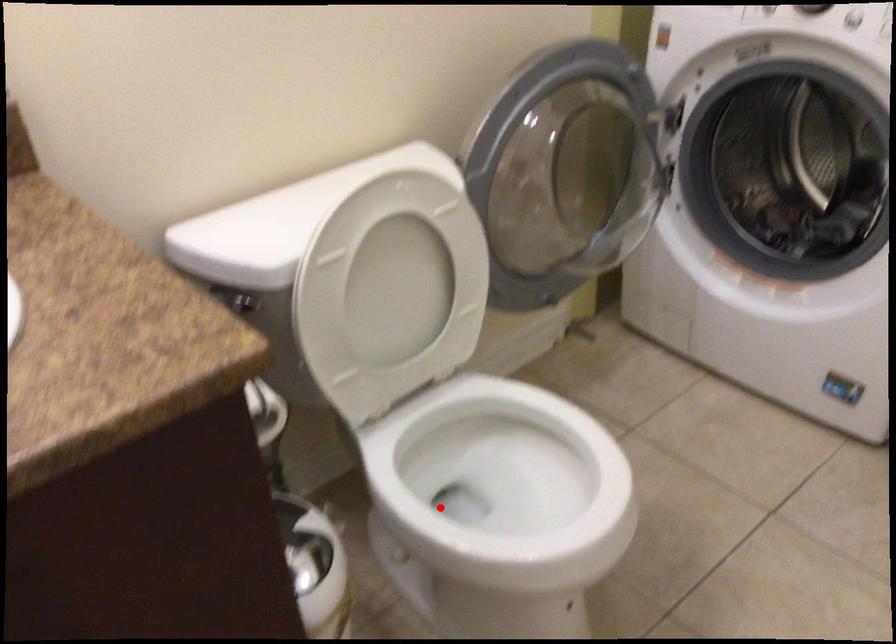
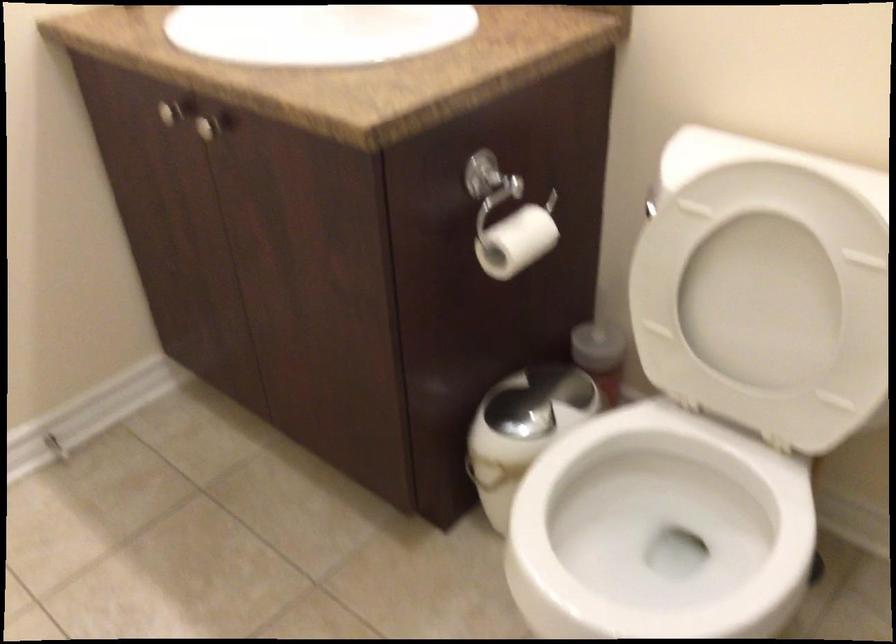
Question: I am providing you with two images of the same scene from different viewpoints. Image1 has a red point marked. In image2, the corresponding 3D location appears at what relative position? Reply with the corresponding letter.

Choices:
 (A) Closer
 (B) Farther

Answer: (A)